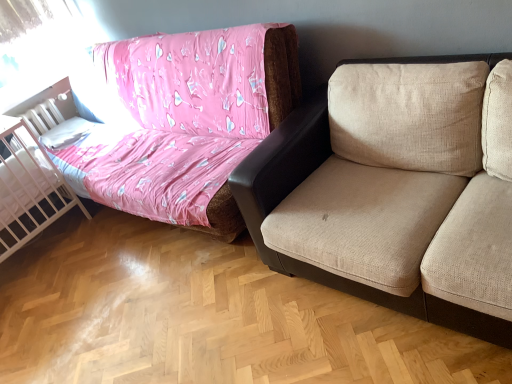
Measure the distance between point (275, 30) and camera.

The distance of point (275, 30) from camera is 6.78 feet.

I want to click on beige fabric studio couch at upper right, so click(x=281, y=73).

The height and width of the screenshot is (384, 512). Describe the element at coordinates (281, 73) in the screenshot. I see `beige fabric studio couch at upper right` at that location.

Measure the distance between beige fabric studio couch at upper right and camera.

beige fabric studio couch at upper right is 2.01 meters away from camera.

What do you see at coordinates (28, 188) in the screenshot? I see `white mesh crib at left` at bounding box center [28, 188].

Locate an element on the screen. Image resolution: width=512 pixels, height=384 pixels. white mesh crib at left is located at coordinates pyautogui.click(x=28, y=188).

Find the location of a particular element. The height and width of the screenshot is (384, 512). beige fabric studio couch at upper right is located at coordinates (281, 73).

Which is more to the left, white mesh crib at left or beige fabric studio couch at upper right?

white mesh crib at left.

Considering the positions of objects white mesh crib at left and beige fabric studio couch at upper right in the image provided, who is behind, white mesh crib at left or beige fabric studio couch at upper right?

white mesh crib at left is further away from the camera.

Which is behind, point (52, 176) or point (268, 79)?

The point (52, 176) is farther from the camera.

From the image's perspective, is white mesh crib at left above or below beige fabric studio couch at upper right?

From the image's perspective, white mesh crib at left appears below beige fabric studio couch at upper right.

From a real-world perspective, is white mesh crib at left positioned over beige fabric studio couch at upper right based on gravity?

Incorrect, from a real-world perspective, white mesh crib at left is lower than beige fabric studio couch at upper right.

Considering the sizes of white mesh crib at left and beige fabric studio couch at upper right in the image, is white mesh crib at left wider or thinner than beige fabric studio couch at upper right?

Considering their sizes, white mesh crib at left looks slimmer than beige fabric studio couch at upper right.

Looking at this image, does white mesh crib at left have a lesser height compared to beige fabric studio couch at upper right?

Indeed, white mesh crib at left has a lesser height compared to beige fabric studio couch at upper right.

Who is smaller, white mesh crib at left or beige fabric studio couch at upper right?

With smaller size is white mesh crib at left.

Do you think white mesh crib at left is within beige fabric studio couch at upper right, or outside of it?

white mesh crib at left cannot be found inside beige fabric studio couch at upper right.

Is white mesh crib at left next to beige fabric studio couch at upper right and touching it?

white mesh crib at left and beige fabric studio couch at upper right are not in contact.

Is white mesh crib at left oriented away from beige fabric studio couch at upper right?

No, white mesh crib at left's orientation is not away from beige fabric studio couch at upper right.

How different are the orientations of white mesh crib at left and beige fabric studio couch at upper right in degrees?

There is a 90.3-degree angle between the facing directions of white mesh crib at left and beige fabric studio couch at upper right.

Measure the distance from white mesh crib at left to beige fabric studio couch at upper right.

white mesh crib at left and beige fabric studio couch at upper right are 1.84 meters apart.

Find the location of a particular element. studio couch that appears in front of the white mesh crib at left is located at coordinates (281, 73).

In the image, is beige fabric studio couch at upper right on the left side or the right side of white mesh crib at left?

In the image, beige fabric studio couch at upper right appears on the right side of white mesh crib at left.

Considering the relative positions of beige fabric studio couch at upper right and white mesh crib at left in the image provided, is beige fabric studio couch at upper right behind white mesh crib at left?

No, beige fabric studio couch at upper right is closer to the viewer.

Which is closer to the camera, [288,61] or [35,222]?

Point [288,61] is positioned closer to the camera compared to point [35,222].

From the image's perspective, relative to white mesh crib at left, is beige fabric studio couch at upper right above or below?

beige fabric studio couch at upper right is situated higher than white mesh crib at left in the image.

From a real-world perspective, is beige fabric studio couch at upper right over white mesh crib at left?

Correct, in the physical world, beige fabric studio couch at upper right is higher than white mesh crib at left.

Considering the sizes of objects beige fabric studio couch at upper right and white mesh crib at left in the image provided, who is thinner, beige fabric studio couch at upper right or white mesh crib at left?

Thinner between the two is white mesh crib at left.

Can you confirm if beige fabric studio couch at upper right is taller than white mesh crib at left?

Yes, beige fabric studio couch at upper right is taller than white mesh crib at left.

In terms of size, does beige fabric studio couch at upper right appear bigger or smaller than white mesh crib at left?

Clearly, beige fabric studio couch at upper right is larger in size than white mesh crib at left.

Does beige fabric studio couch at upper right contain white mesh crib at left?

That's incorrect, white mesh crib at left is not inside beige fabric studio couch at upper right.

Would you consider beige fabric studio couch at upper right to be distant from white mesh crib at left?

beige fabric studio couch at upper right is positioned a significant distance from white mesh crib at left.

Does beige fabric studio couch at upper right turn towards white mesh crib at left?

Yes, beige fabric studio couch at upper right is oriented towards white mesh crib at left.

This screenshot has height=384, width=512. Find the location of `infant bed on the left of beige fabric studio couch at upper right`. infant bed on the left of beige fabric studio couch at upper right is located at coordinates (28, 188).

Where is `infant bed located underneath the beige fabric studio couch at upper right (from a real-world perspective)`? This screenshot has width=512, height=384. infant bed located underneath the beige fabric studio couch at upper right (from a real-world perspective) is located at coordinates (28, 188).

Find the location of a particular element. The image size is (512, 384). infant bed that is below the beige fabric studio couch at upper right (from the image's perspective) is located at coordinates (28, 188).